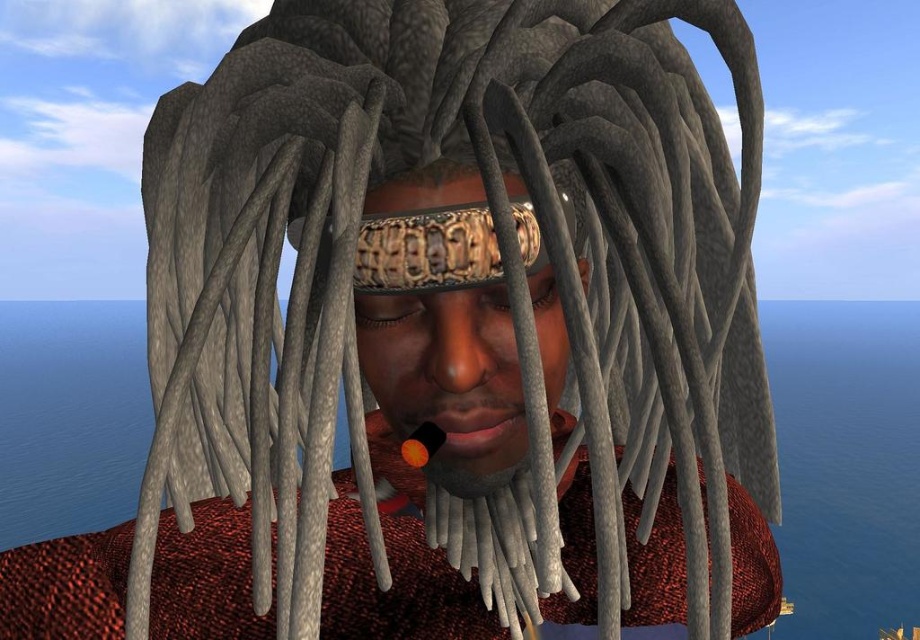
You are a stylist trying to style the textured gray dreadlocks at center and the metallic gold headband at center. Which object is taller?

The textured gray dreadlocks at center are taller than the metallic gold headband at center.

Based on the scene description, can you determine which object has a greater width between the textured gray dreadlocks at center and the metallic gold headband at center?

The textured gray dreadlocks at center have a greater width than the metallic gold headband at center according to the description.

You are a hair stylist trying to place a new accessory between the textured gray dreadlocks at center and the metallic gold headband at center. The accessory requires 12 centimeters of space. Based on the scene, can you fit it there?

The distance between the textured gray dreadlocks at center and the metallic gold headband at center is 10.20 centimeters, which is less than the required 12 centimeters. Therefore, the accessory cannot be placed there.